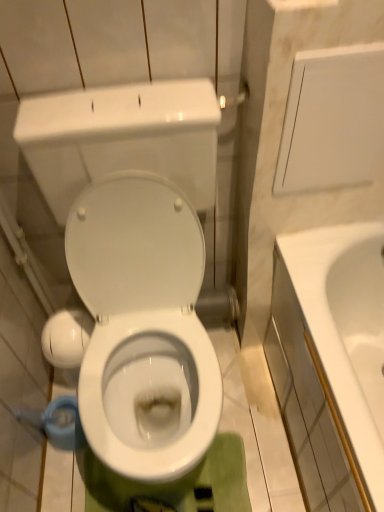
What is the approximate width of white glossy sink at right?

white glossy sink at right is 19.45 inches in width.

Measure the distance between white glossy sink at right and camera.

white glossy sink at right is 30.60 inches away from camera.

You are a GUI agent. You are given a task and a screenshot of the screen. Output one action in this format:
    pyautogui.click(x=<x>, y=<y>)
    Task: Click on the white glossy sink at right
    This screenshot has height=512, width=384.
    Given the screenshot: What is the action you would take?
    pyautogui.click(x=331, y=361)

What do you see at coordinates (331, 361) in the screenshot? I see `white glossy sink at right` at bounding box center [331, 361].

The width and height of the screenshot is (384, 512). What are the coordinates of `white glossy sink at right` in the screenshot? It's located at (331, 361).